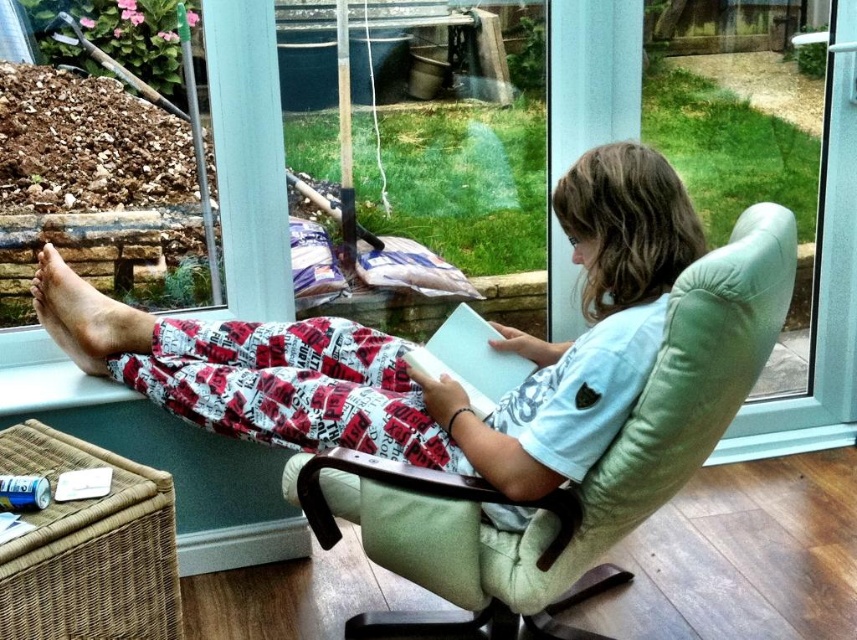
You are a tailor measuring for a new shirt. You see the light blue cotton shirt at center and the skinny barefoot at lower left. Which object has a larger width?

The light blue cotton shirt at center might be wider than skinny barefoot at lower left.

Consider the image. You are a photographer trying to capture the light blue cotton shirt at center and the skinny barefoot at lower left in the same frame. Based on their positions, can you tell which object is closer to the camera?

The light blue cotton shirt at center is positioned under the skinny barefoot at lower left, meaning the shirt is behind the foot, so the foot is closer to the camera.

You are standing in the room and looking through the window. There are two points marked on the window glass. The first point is at coordinates point (220, 353) and the second point is at coordinates point (129, 348). Which point is closer to you?

Point (220, 353) is in front of point (129, 348), so it is closer to you.